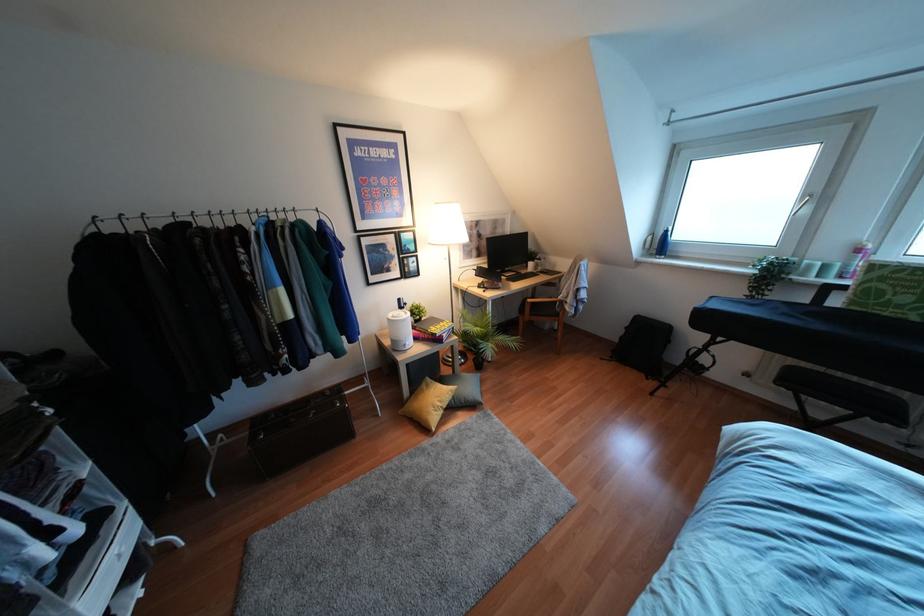
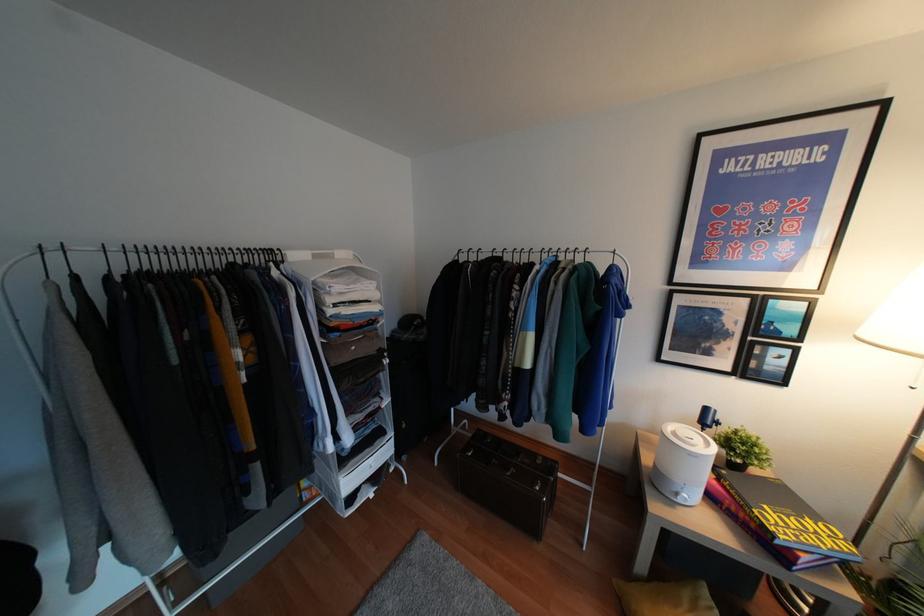
Question: The images are taken continuously from a first-person perspective. In which direction is your viewpoint rotating?

Choices:
 (A) Left
 (B) Right
 (C) Up
 (D) Down

Answer: (A)